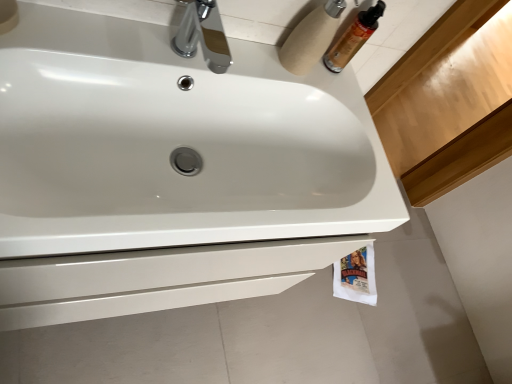
Locate an element on the screen. Image resolution: width=512 pixels, height=384 pixels. free spot behind white paper towel at lower right, arranged as the second toilet paper when viewed from the top is located at coordinates (391, 251).